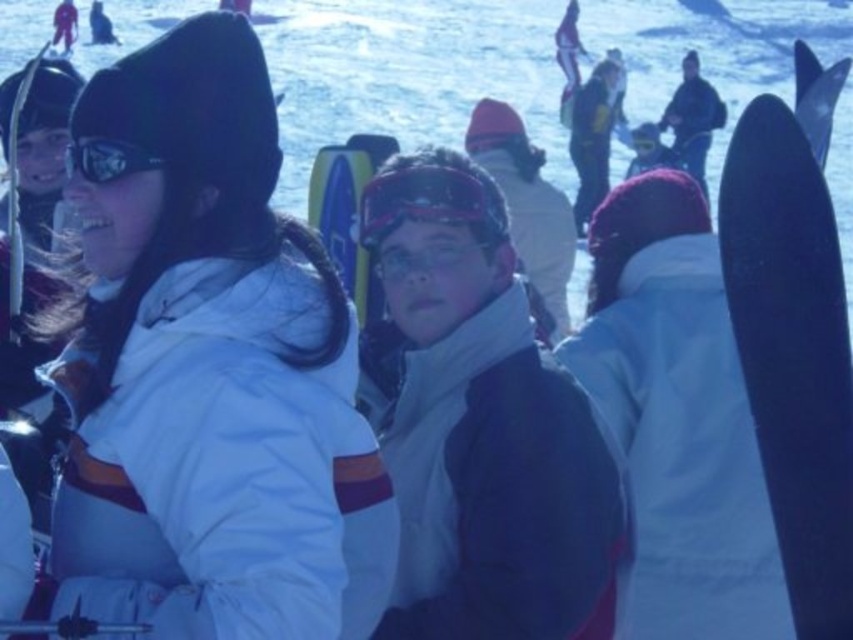
Who is more distant from viewer, (418,404) or (724,218)?

The point (418,404) is more distant.

Which of these two, matte blue jacket at center or black matte ski at right, stands taller?

With more height is black matte ski at right.

Which is in front, point (375, 337) or point (776, 204)?

Point (776, 204)

Where is `matte blue jacket at center`? The width and height of the screenshot is (853, 640). matte blue jacket at center is located at coordinates (479, 424).

Is white matte jacket at upper left below matte black ski at left?

Indeed, white matte jacket at upper left is positioned under matte black ski at left.

The width and height of the screenshot is (853, 640). Find the location of `white matte jacket at upper left`. white matte jacket at upper left is located at coordinates (210, 372).

This screenshot has width=853, height=640. What are the coordinates of `white matte jacket at upper left` in the screenshot? It's located at (210, 372).

Who is more distant from viewer, (793, 432) or (112, 168)?

The point (793, 432) is more distant.

Image resolution: width=853 pixels, height=640 pixels. Identify the location of black matte ski at right. (793, 336).